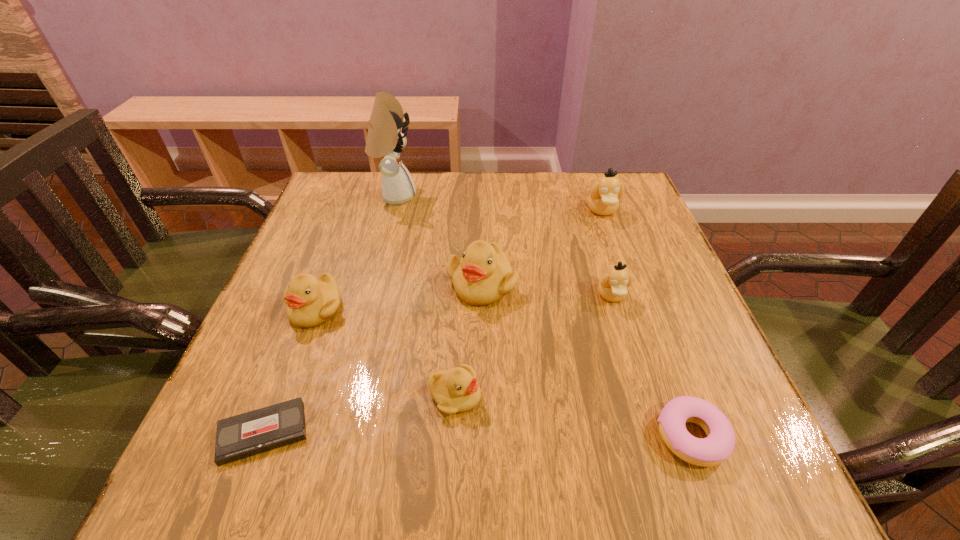
Where is `object located at the near left corner`? This screenshot has width=960, height=540. object located at the near left corner is located at coordinates (244, 435).

Where is `object located in the far right corner section of the desktop`? The image size is (960, 540). object located in the far right corner section of the desktop is located at coordinates (603, 199).

This screenshot has height=540, width=960. In order to click on object that is positioned at the near right corner in this screenshot , I will do 716,448.

Identify the location of blank space at the far edge. The image size is (960, 540). (516, 206).

At what (x,y) coordinates should I click in order to perform the action: click on vacant area at the near edge of the desktop. Please return your answer as a coordinate pair (x, y). The height and width of the screenshot is (540, 960). Looking at the image, I should click on pos(517,478).

You are a GUI agent. You are given a task and a screenshot of the screen. Output one action in this format:
    pyautogui.click(x=<x>, y=<y>)
    Task: Click on the vacant area at the left edge
    This screenshot has height=540, width=960.
    Given the screenshot: What is the action you would take?
    pyautogui.click(x=295, y=388)

The image size is (960, 540). I want to click on vacant space at the right edge of the desktop, so click(x=657, y=308).

This screenshot has width=960, height=540. What are the coordinates of `vacant space at the far left corner` in the screenshot? It's located at (369, 205).

Where is `free spot at the far right corner of the desktop`? This screenshot has width=960, height=540. free spot at the far right corner of the desktop is located at coordinates (579, 180).

In the image, there is a desktop. At what (x,y) coordinates should I click in order to perform the action: click on vacant space at the near right corner. Please return your answer as a coordinate pair (x, y). Looking at the image, I should click on (660, 454).